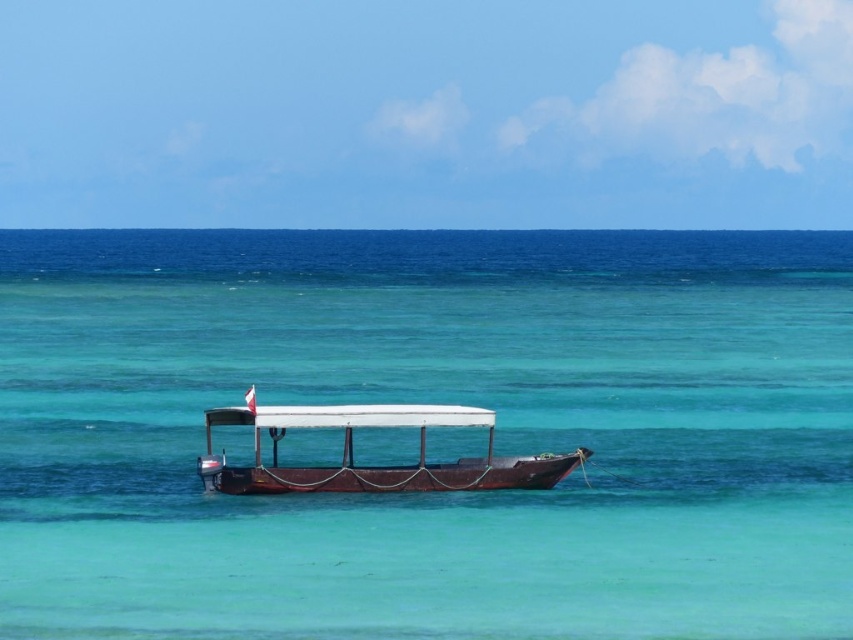
Who is positioned more to the right, clear turquoise water at center or wooden boat at center?

clear turquoise water at center is more to the right.

Can you confirm if clear turquoise water at center is shorter than wooden boat at center?

In fact, clear turquoise water at center may be taller than wooden boat at center.

What are the coordinates of `clear turquoise water at center` in the screenshot? It's located at (431, 401).

Find the location of a particular element. The image size is (853, 640). clear turquoise water at center is located at coordinates (431, 401).